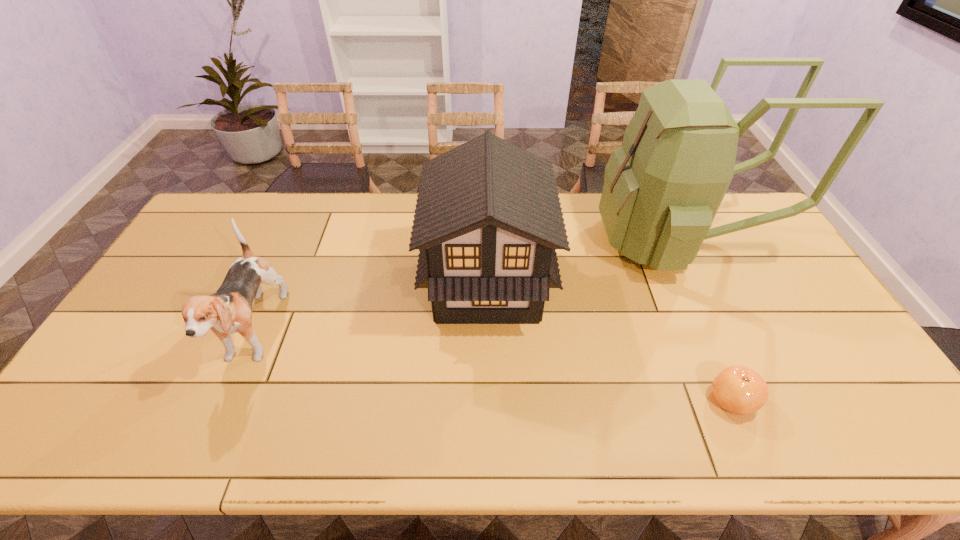
Where is `vacant area that lies between the puppy and the dollhouse`? The height and width of the screenshot is (540, 960). vacant area that lies between the puppy and the dollhouse is located at coordinates (371, 309).

Where is `empty space that is in between the dollhouse and the puppy`? Image resolution: width=960 pixels, height=540 pixels. empty space that is in between the dollhouse and the puppy is located at coordinates click(x=371, y=309).

Where is `unoccupied position between the puppy and the dollhouse`? The height and width of the screenshot is (540, 960). unoccupied position between the puppy and the dollhouse is located at coordinates (371, 309).

You are a GUI agent. You are given a task and a screenshot of the screen. Output one action in this format:
    pyautogui.click(x=<x>, y=<y>)
    Task: Click on the third closest object to the leftmost object
    The height and width of the screenshot is (540, 960).
    Given the screenshot: What is the action you would take?
    pyautogui.click(x=740, y=390)

I want to click on object that is the third closest one to the leftmost object, so click(740, 390).

In order to click on free space that satisfies the following two spatial constraints: 1. on the front-facing side of the third object from right to left; 2. at the face of the leftmost object in this screenshot , I will do `click(488, 334)`.

Locate an element on the screen. vacant space that satisfies the following two spatial constraints: 1. on the front pocket of the tallest object; 2. on the front side of the clementine is located at coordinates (752, 400).

The height and width of the screenshot is (540, 960). I want to click on vacant space that satisfies the following two spatial constraints: 1. on the front pocket of the tallest object; 2. at the face of the puppy, so pyautogui.click(x=721, y=334).

Locate an element on the screen. free spot that satisfies the following two spatial constraints: 1. on the front-facing side of the third object from right to left; 2. at the face of the puppy is located at coordinates (488, 334).

Locate an element on the screen. This screenshot has width=960, height=540. vacant region that satisfies the following two spatial constraints: 1. on the front pocket of the backpack; 2. on the front side of the clementine is located at coordinates (752, 400).